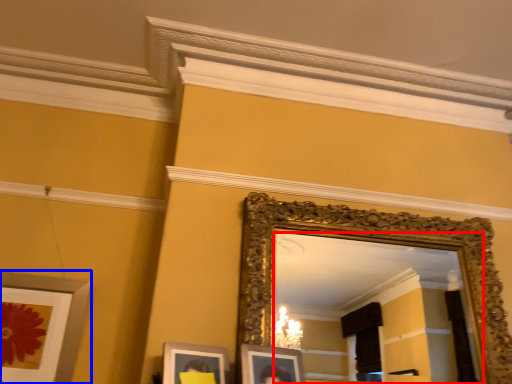
Question: Which object is further to the camera taking this photo, mirror (highlighted by a red box) or picture frame (highlighted by a blue box)?

Choices:
 (A) mirror
 (B) picture frame

Answer: (B)